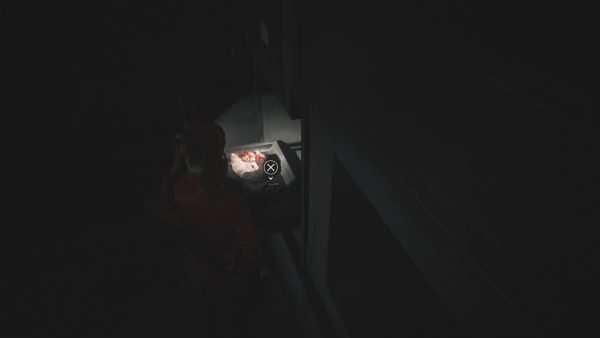
Find the location of a particular element. wall is located at coordinates (280, 128).